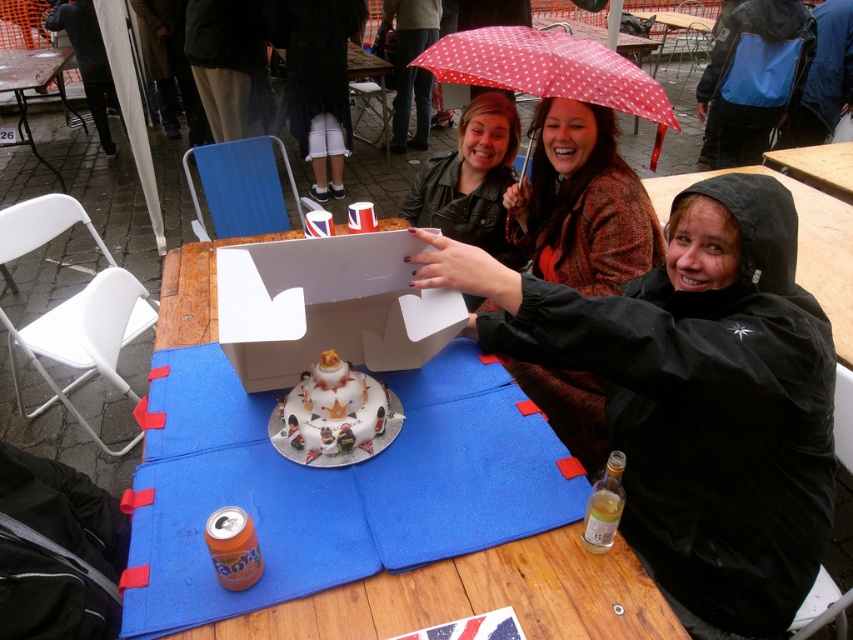
Question: Which point is farther to the camera?

Choices:
 (A) (372, 406)
 (B) (440, 204)
 (C) (561, 211)
 (D) (793, 486)

Answer: (B)

Question: Estimate the real-world distances between objects in this image. Which object is closer to the leather jacket at center?

Choices:
 (A) polka dot fabric umbrella at upper center
 (B) white cardboard box at center

Answer: (A)

Question: Which object is farther from the camera taking this photo?

Choices:
 (A) white cardboard box at center
 (B) patterned fabric jacket at center
 (C) polka dot fabric umbrella at upper center

Answer: (B)

Question: Is patterned fabric jacket at center above decorative fondant cake at center?

Choices:
 (A) no
 (B) yes

Answer: (B)

Question: Can you confirm if blue felt table at center is positioned to the right of polka dot fabric umbrella at upper center?

Choices:
 (A) yes
 (B) no

Answer: (B)

Question: Is black matte raincoat at lower right bigger than patterned fabric jacket at center?

Choices:
 (A) no
 (B) yes

Answer: (B)